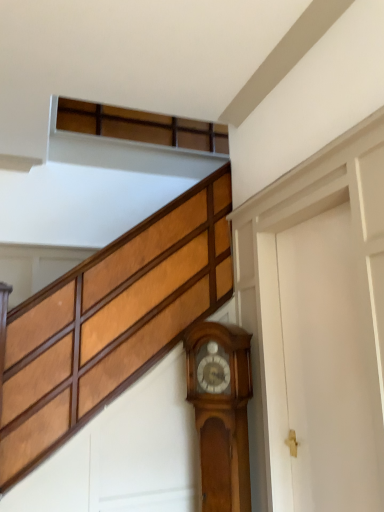
Question: Can you confirm if polished wood grandfather clock at lower right is shorter than white matte door at right?

Choices:
 (A) yes
 (B) no

Answer: (A)

Question: Is white matte door at right at the back of polished wood grandfather clock at lower right?

Choices:
 (A) no
 (B) yes

Answer: (A)

Question: Are polished wood grandfather clock at lower right and white matte door at right making contact?

Choices:
 (A) yes
 (B) no

Answer: (B)

Question: Is polished wood grandfather clock at lower right to the left of white matte door at right from the viewer's perspective?

Choices:
 (A) no
 (B) yes

Answer: (B)

Question: Is polished wood grandfather clock at lower right oriented towards white matte door at right?

Choices:
 (A) yes
 (B) no

Answer: (B)

Question: From the image's perspective, is polished wood grandfather clock at lower right under white matte door at right?

Choices:
 (A) yes
 (B) no

Answer: (A)

Question: From a real-world perspective, is white matte door at right on polished wood grandfather clock at lower right?

Choices:
 (A) no
 (B) yes

Answer: (B)

Question: From the image's perspective, would you say white matte door at right is positioned over polished wood grandfather clock at lower right?

Choices:
 (A) yes
 (B) no

Answer: (A)

Question: Can you confirm if white matte door at right is bigger than polished wood grandfather clock at lower right?

Choices:
 (A) yes
 (B) no

Answer: (A)

Question: Does white matte door at right have a greater height compared to polished wood grandfather clock at lower right?

Choices:
 (A) yes
 (B) no

Answer: (A)

Question: Is there a large distance between white matte door at right and polished wood grandfather clock at lower right?

Choices:
 (A) no
 (B) yes

Answer: (A)

Question: Is white matte door at right facing away from polished wood grandfather clock at lower right?

Choices:
 (A) yes
 (B) no

Answer: (B)

Question: Choose the correct answer: Is white matte door at right inside polished wood grandfather clock at lower right or outside it?

Choices:
 (A) outside
 (B) inside

Answer: (A)